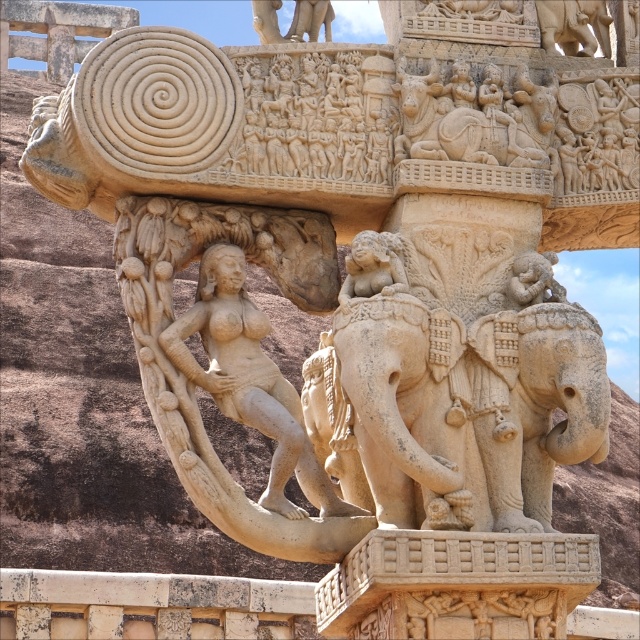
Who is positioned more to the right, carved stone elephant at center or beige stone elephant at upper center?

From the viewer's perspective, beige stone elephant at upper center appears more on the right side.

Does carved stone elephant at center appear under beige stone elephant at upper center?

Yes.

Is point (566, 433) in front of point (576, 10)?

Yes.

This screenshot has height=640, width=640. I want to click on carved stone elephant at center, so click(x=541, y=406).

Can you confirm if beige stone statue at center is bigger than beige stone elephant at upper center?

Correct, beige stone statue at center is larger in size than beige stone elephant at upper center.

Can you confirm if beige stone statue at center is wider than beige stone elephant at upper center?

Yes.

Identify the location of beige stone statue at center. The width and height of the screenshot is (640, 640). (250, 380).

Find the location of a particular element. This screenshot has height=640, width=640. beige stone statue at center is located at coordinates (250, 380).

Which is above, beige stone elephant at center or beige stone elephant at upper center?

Positioned higher is beige stone elephant at upper center.

Can you confirm if beige stone elephant at center is shorter than beige stone elephant at upper center?

Yes.

Between point (461, 340) and point (557, 29), which one is positioned in front?

Point (461, 340) is more forward.

Locate an element on the screen. beige stone elephant at center is located at coordinates (403, 408).